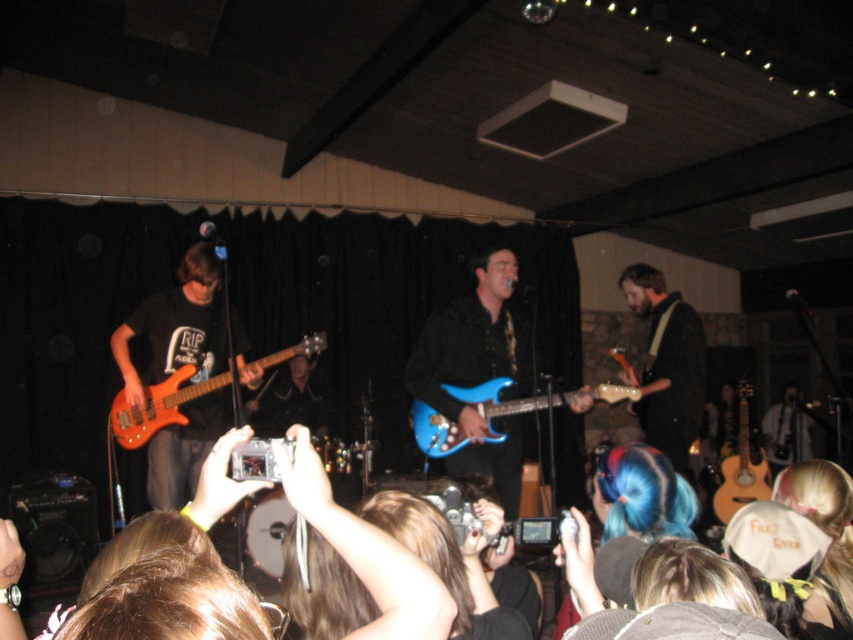
You are a photographer at the back of the venue. You want to take a photo of the shiny brown guitar at center and the acoustic wood guitar at right. From your perspective, which guitar appears closer to the front of the stage?

The shiny brown guitar at center appears closer to the front of the stage because it is positioned over the acoustic wood guitar at right, indicating it is in front.

You are a photographer at the back of the venue and want to take a clear photo of both the matte orange bass guitar at left and the acoustic wood guitar at right. Which guitar will appear larger in your photo?

The matte orange bass guitar at left will appear larger in the photo because it is closer to the viewer than the acoustic wood guitar at right.

Looking at this image, you are a photographer at the back of the venue. You want to capture a photo of both the matte orange bass guitar at left and the acoustic wood guitar at right in the same frame. Based on their positions, which guitar should you adjust your camera to focus on first to ensure both are in the shot?

The matte orange bass guitar at left is to the left of the acoustic wood guitar at right, so you should focus on the acoustic wood guitar at right first to ensure both are in the frame.